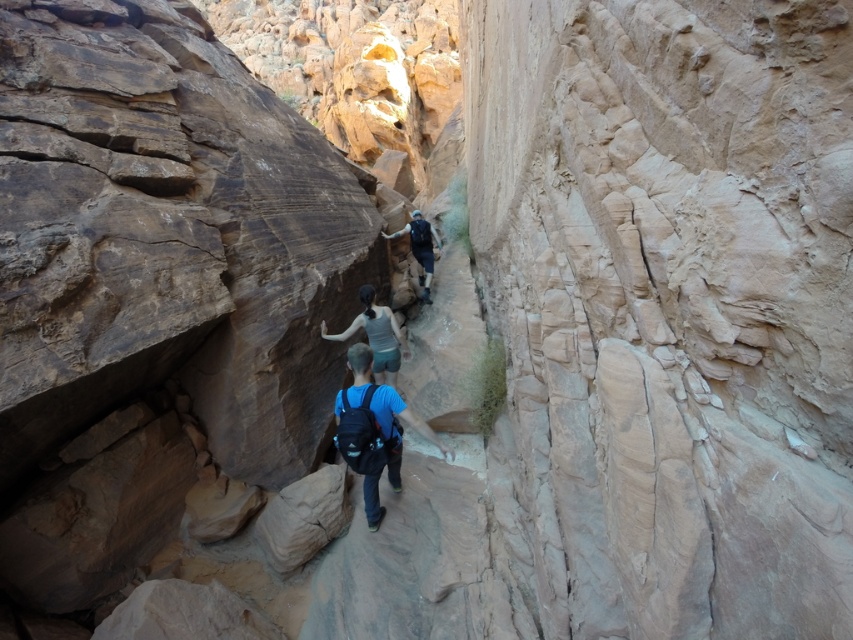
You are a hiker trying to locate your friend who is wearing a light blue fabric shirt at center. Based on the coordinates provided, where exactly is your friend positioned in the canyon?

The light blue fabric shirt at center is located at point (x=376, y=337), which means your friend is positioned near the center of the canyon, slightly to the right and halfway up the vertical axis.

You are a hiker in the canyon and want to reach the smooth beige rock at center. You are currently at the point marked as point (672,304). Can you directly walk to the smooth beige rock at center from your current position?

The point (672,304) is on the smooth beige rock at center, so you are already on the smooth beige rock at center and can proceed further if needed.

You are a hiker trying to locate your friend who is wearing a blue shirt and carrying a backpack. You see a point at coordinates [381,410] in the image. Is this point on the blue fabric backpack at center?

Yes, the point at [381,410] is on the blue fabric backpack at center, so it is your friend.